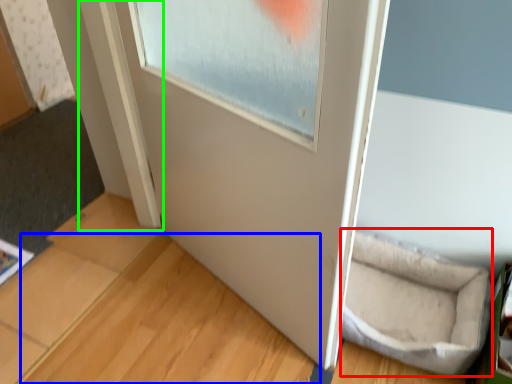
Question: Considering the real-world distances, which object is closest to wide (highlighted by a red box)? wood (highlighted by a blue box) or window frame (highlighted by a green box).

Choices:
 (A) wood
 (B) window frame

Answer: (A)